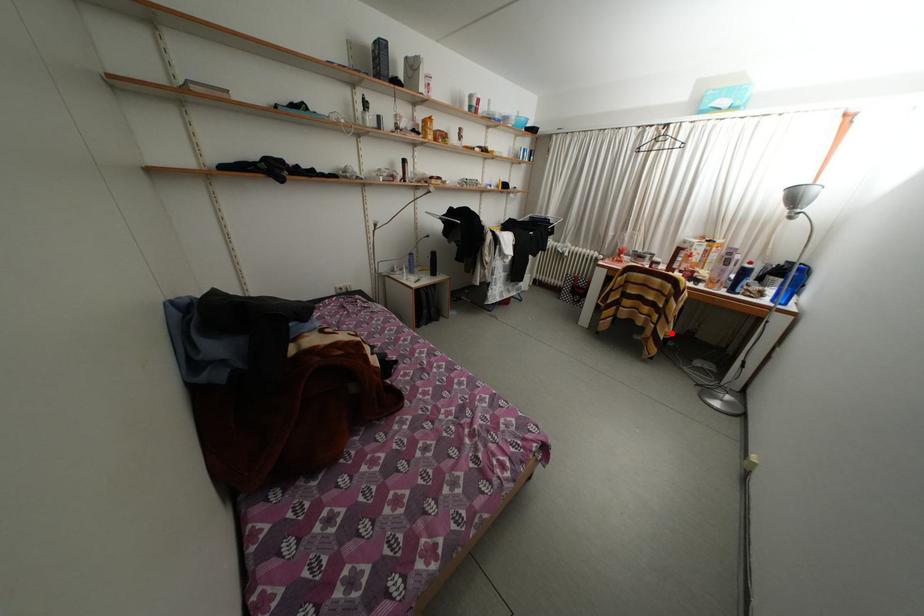
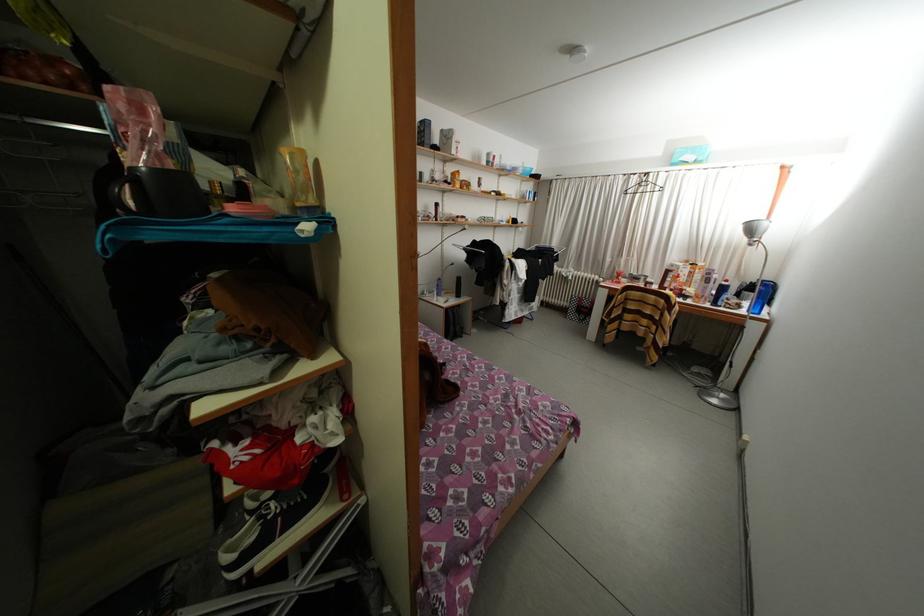
Question: I am providing you with two images of the same scene from different viewpoints. Image1 has a red point marked. In image2, the corresponding 3D location appears at what relative position? Reply with the corresponding letter.

Choices:
 (A) Closer
 (B) Farther

Answer: (B)